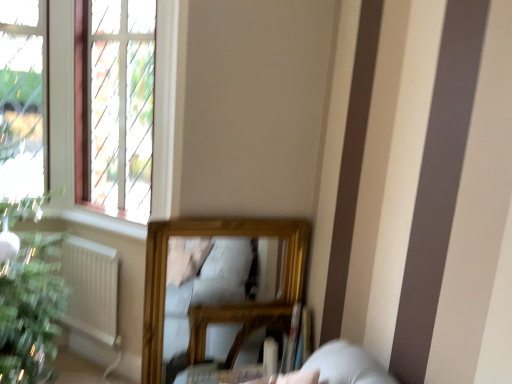
Describe the element at coordinates (234, 322) in the screenshot. I see `wooden table at lower center` at that location.

What do you see at coordinates (91, 287) in the screenshot? I see `white matte radiator at lower left` at bounding box center [91, 287].

This screenshot has width=512, height=384. In order to click on wooden table at lower center in this screenshot , I will do `click(234, 322)`.

Would you say clear glass window at upper left is inside or outside green matte houseplant at lower left?

The correct answer is: outside.

Consider the image. Considering the sizes of objects clear glass window at upper left and green matte houseplant at lower left in the image provided, who is bigger, clear glass window at upper left or green matte houseplant at lower left?

With larger size is clear glass window at upper left.

Does clear glass window at upper left turn towards green matte houseplant at lower left?

No, clear glass window at upper left does not turn towards green matte houseplant at lower left.

From their relative heights in the image, would you say clear glass window at upper left is taller or shorter than green matte houseplant at lower left?

Clearly, clear glass window at upper left is taller compared to green matte houseplant at lower left.

Is point (66, 275) positioned in front of point (63, 283)?

No, (66, 275) is behind (63, 283).

From the image's perspective, would you say white matte radiator at lower left is positioned over green matte houseplant at lower left?

Yes.

Can green matte houseplant at lower left be found inside white matte radiator at lower left?

Actually, green matte houseplant at lower left is outside white matte radiator at lower left.

Considering the sizes of objects white matte radiator at lower left and green matte houseplant at lower left in the image provided, who is smaller, white matte radiator at lower left or green matte houseplant at lower left?

Smaller between the two is green matte houseplant at lower left.

Is point (133, 187) less distant than point (87, 301)?

Yes, it is.

Would you consider clear glass window at upper left to be distant from white matte radiator at lower left?

No, clear glass window at upper left is not far away from white matte radiator at lower left.

From the image's perspective, is clear glass window at upper left over white matte radiator at lower left?

Indeed, from the image's perspective, clear glass window at upper left is shown above white matte radiator at lower left.

How much distance is there between clear glass window at upper left and white matte radiator at lower left?

They are 24.95 inches apart.

Which is behind, wooden table at lower center or clear glass window at upper left?

clear glass window at upper left.

Is point (231, 304) closer or farther from the camera than point (127, 193)?

Point (231, 304) appears to be closer to the viewer than point (127, 193).

Can you confirm if wooden table at lower center is wider than clear glass window at upper left?

In fact, wooden table at lower center might be narrower than clear glass window at upper left.

Identify the location of window behind the wooden table at lower center. (114, 105).

Can you tell me how much green matte houseplant at lower left and clear glass window at upper left differ in facing direction?

44.3 degrees separate the facing orientations of green matte houseplant at lower left and clear glass window at upper left.

Is point (15, 295) positioned before point (106, 198)?

That is True.

Would you consider green matte houseplant at lower left to be distant from clear glass window at upper left?

No, green matte houseplant at lower left is not far from clear glass window at upper left.

Is clear glass window at upper left at the back of green matte houseplant at lower left?

No, clear glass window at upper left is not at the back of green matte houseplant at lower left.

Does green matte houseplant at lower left turn towards wooden table at lower center?

No, green matte houseplant at lower left is not aimed at wooden table at lower center.

Locate an element on the screen. The width and height of the screenshot is (512, 384). houseplant that appears behind the wooden table at lower center is located at coordinates (30, 307).

Measure the distance from green matte houseplant at lower left to wooden table at lower center.

green matte houseplant at lower left and wooden table at lower center are 33.69 inches apart.

Is green matte houseplant at lower left far from wooden table at lower center?

green matte houseplant at lower left is actually quite close to wooden table at lower center.

Is point (275, 313) closer to viewer compared to point (88, 272)?

Yes, it is.

Is white matte radiator at lower left at the back of wooden table at lower center?

No, wooden table at lower center is not facing the opposite direction of white matte radiator at lower left.

Considering the relative sizes of wooden table at lower center and white matte radiator at lower left in the image provided, is wooden table at lower center wider than white matte radiator at lower left?

Yes.

From a real-world perspective, does wooden table at lower center sit lower than white matte radiator at lower left?

Yes, from a real-world perspective, wooden table at lower center is beneath white matte radiator at lower left.

This screenshot has width=512, height=384. Identify the location of window that appears in front of the green matte houseplant at lower left. (114, 105).

Where is `houseplant beneath the white matte radiator at lower left (from a real-world perspective)`? Image resolution: width=512 pixels, height=384 pixels. houseplant beneath the white matte radiator at lower left (from a real-world perspective) is located at coordinates (30, 307).

Estimate the real-world distances between objects in this image. Which object is closer to wooden table at lower center, white matte radiator at lower left or green matte houseplant at lower left?

white matte radiator at lower left lies closer to wooden table at lower center than the other object.

Considering their positions, is clear glass window at upper left positioned closer to white matte radiator at lower left than green matte houseplant at lower left?

Among the two, green matte houseplant at lower left is located nearer to white matte radiator at lower left.

Which object lies nearer to the anchor point clear glass window at upper left, green matte houseplant at lower left or white matte radiator at lower left?

white matte radiator at lower left.

In the scene shown: Based on their spatial positions, is green matte houseplant at lower left or wooden table at lower center further from white matte radiator at lower left?

Based on the image, wooden table at lower center appears to be further to white matte radiator at lower left.

Based on their spatial positions, is wooden table at lower center or white matte radiator at lower left closer to clear glass window at upper left?

The object closer to clear glass window at upper left is white matte radiator at lower left.

Which object lies nearer to the anchor point green matte houseplant at lower left, clear glass window at upper left or wooden table at lower center?

The object closer to green matte houseplant at lower left is clear glass window at upper left.

Considering their positions, is green matte houseplant at lower left positioned further to wooden table at lower center than white matte radiator at lower left?

Based on the image, green matte houseplant at lower left appears to be further to wooden table at lower center.

Looking at the image, which one is located further to green matte houseplant at lower left, wooden table at lower center or clear glass window at upper left?

Among the two, wooden table at lower center is located further to green matte houseplant at lower left.

At what (x,y) coordinates should I click in order to perform the action: click on radiator located between green matte houseplant at lower left and wooden table at lower center in the left-right direction. Please return your answer as a coordinate pair (x, y). Looking at the image, I should click on (91, 287).

Where is `radiator between clear glass window at upper left and wooden table at lower center in the vertical direction`? The image size is (512, 384). radiator between clear glass window at upper left and wooden table at lower center in the vertical direction is located at coordinates (91, 287).

Image resolution: width=512 pixels, height=384 pixels. Identify the location of radiator between clear glass window at upper left and green matte houseplant at lower left from top to bottom. (91, 287).

This screenshot has height=384, width=512. Identify the location of houseplant between clear glass window at upper left and wooden table at lower center vertically. (30, 307).